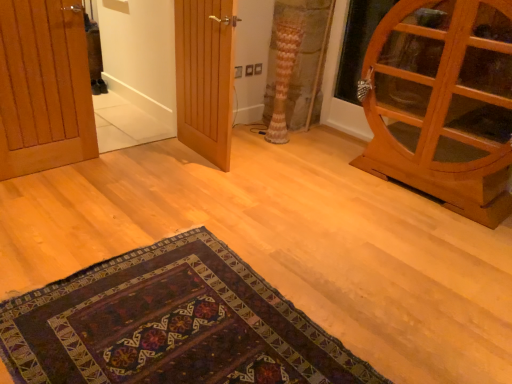
Question: Does wooden cabinet at right, which is counted as the 3th door, starting from the left, have a greater width compared to wooden door at center, the second door in the right-to-left sequence?

Choices:
 (A) yes
 (B) no

Answer: (A)

Question: Is wooden cabinet at right, which is counted as the 3th door, starting from the left, positioned with its back to wooden door at center, the 2th door when ordered from left to right?

Choices:
 (A) yes
 (B) no

Answer: (B)

Question: Are wooden cabinet at right, positioned as the 1th door in right-to-left order, and wooden door at center, the second door in the right-to-left sequence, making contact?

Choices:
 (A) no
 (B) yes

Answer: (A)

Question: Can you confirm if wooden cabinet at right, which is counted as the 3th door, starting from the left, is positioned to the left of wooden door at center, the 2th door when ordered from left to right?

Choices:
 (A) no
 (B) yes

Answer: (A)

Question: Is wooden cabinet at right, which is counted as the 3th door, starting from the left, positioned far away from wooden door at center, the 2th door when ordered from left to right?

Choices:
 (A) no
 (B) yes

Answer: (B)

Question: Considering the positions of point (282, 364) and point (407, 167), is point (282, 364) closer or farther from the camera than point (407, 167)?

Choices:
 (A) farther
 (B) closer

Answer: (B)

Question: Considering their positions, is dark woven rug at lower center located in front of or behind wooden cabinet at right, positioned as the 1th door in right-to-left order?

Choices:
 (A) behind
 (B) front

Answer: (B)

Question: Based on their sizes in the image, would you say dark woven rug at lower center is bigger or smaller than wooden cabinet at right, which is counted as the 3th door, starting from the left?

Choices:
 (A) small
 (B) big

Answer: (A)

Question: From a real-world perspective, is dark woven rug at lower center physically located above or below wooden cabinet at right, positioned as the 1th door in right-to-left order?

Choices:
 (A) above
 (B) below

Answer: (B)

Question: Considering the positions of point (3, 97) and point (285, 61), is point (3, 97) closer or farther from the camera than point (285, 61)?

Choices:
 (A) closer
 (B) farther

Answer: (A)

Question: Looking at the image, does wooden door at left, the 1th door from the left, seem bigger or smaller compared to patterned fabric curtain at center?

Choices:
 (A) small
 (B) big

Answer: (A)

Question: In terms of height, does wooden door at left, the 1th door from the left, look taller or shorter compared to patterned fabric curtain at center?

Choices:
 (A) short
 (B) tall

Answer: (B)

Question: Looking at their shapes, would you say wooden door at left, the 1th door from the left, is wider or thinner than patterned fabric curtain at center?

Choices:
 (A) wide
 (B) thin

Answer: (B)

Question: From a real-world perspective, is wooden door at left, the 1th door from the left, physically located above or below wooden door at center, the 2th door when ordered from left to right?

Choices:
 (A) below
 (B) above

Answer: (A)

Question: Considering their positions, is wooden door at left, the 1th door from the left, located in front of or behind wooden door at center, the second door in the right-to-left sequence?

Choices:
 (A) front
 (B) behind

Answer: (A)